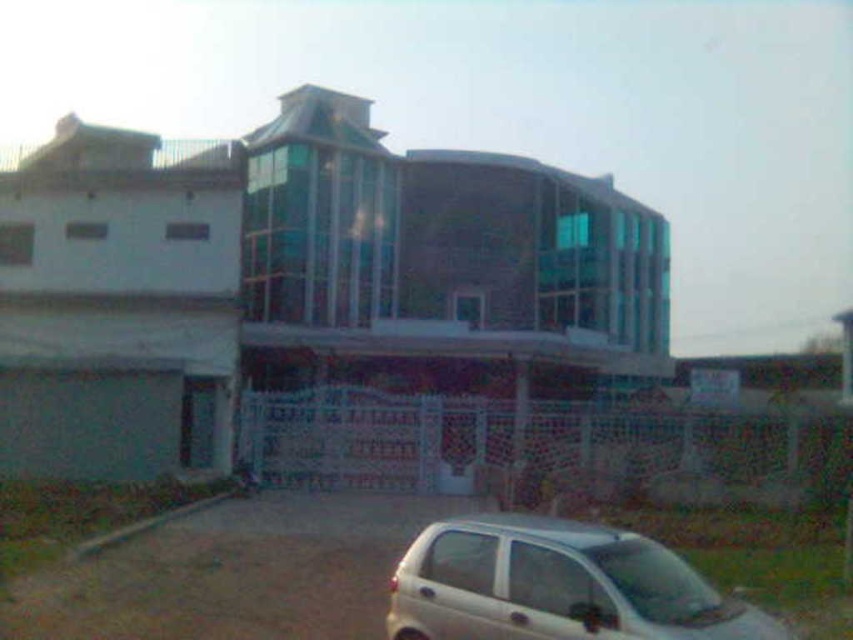
You are a delivery person arriving at the building and need to park your white matte car at lower right. The parking space is marked by brown gravel at lower center. Can you determine if the parking space is wide enough for your car?

The brown gravel at lower center might be wider than white matte car at lower right, so there is a possibility that the parking space is wide enough for the car.

You are a delivery person trying to park your white matte car at lower right. There is a brown gravel at lower center where you want to park. Is the parking spot under the car already occupied?

The brown gravel at lower center is positioned under the white matte car at lower right, indicating that the parking spot is already occupied by the car.